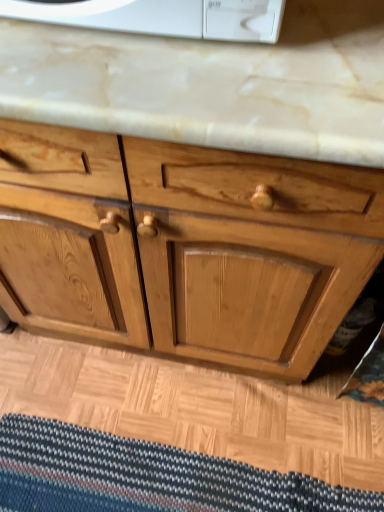
What do you see at coordinates (146, 476) in the screenshot? The width and height of the screenshot is (384, 512). I see `striped fabric doormat at lower center` at bounding box center [146, 476].

Find the location of `striped fabric doormat at lower center`. striped fabric doormat at lower center is located at coordinates (146, 476).

At what (x,y) coordinates should I click in order to perform the action: click on light brown wood chest of drawers at center. Please return your answer as a coordinate pair (x, y). This screenshot has width=384, height=512. Looking at the image, I should click on (188, 246).

From the picture: In order to face light brown wood chest of drawers at center, should I rotate leftwards or rightwards?

A 4.632 degree turn to the right will do.

Describe the element at coordinates (188, 246) in the screenshot. I see `light brown wood chest of drawers at center` at that location.

The image size is (384, 512). I want to click on striped fabric doormat at lower center, so click(146, 476).

Considering the relative positions of striped fabric doormat at lower center and light brown wood chest of drawers at center in the image provided, is striped fabric doormat at lower center to the right of light brown wood chest of drawers at center from the viewer's perspective?

No.

Considering their positions, is striped fabric doormat at lower center located in front of or behind light brown wood chest of drawers at center?

striped fabric doormat at lower center is behind light brown wood chest of drawers at center.

Which point is more distant from viewer, (29, 498) or (292, 303)?

The point (29, 498) is behind.

From the image's perspective, which is below, striped fabric doormat at lower center or light brown wood chest of drawers at center?

striped fabric doormat at lower center is shown below in the image.

From a real-world perspective, between striped fabric doormat at lower center and light brown wood chest of drawers at center, who is vertically higher?

light brown wood chest of drawers at center is physically above.

Does striped fabric doormat at lower center have a lesser width compared to light brown wood chest of drawers at center?

Yes, striped fabric doormat at lower center is thinner than light brown wood chest of drawers at center.

Looking at this image, considering the relative sizes of striped fabric doormat at lower center and light brown wood chest of drawers at center in the image provided, is striped fabric doormat at lower center shorter than light brown wood chest of drawers at center?

Correct, striped fabric doormat at lower center is not as tall as light brown wood chest of drawers at center.

Is striped fabric doormat at lower center bigger than light brown wood chest of drawers at center?

No.

Would you say striped fabric doormat at lower center is outside light brown wood chest of drawers at center?

Indeed, striped fabric doormat at lower center is completely outside light brown wood chest of drawers at center.

Is striped fabric doormat at lower center positioned far away from light brown wood chest of drawers at center?

No, striped fabric doormat at lower center is not far away from light brown wood chest of drawers at center.

Is striped fabric doormat at lower center looking in the opposite direction of light brown wood chest of drawers at center?

Absolutely, striped fabric doormat at lower center is directed away from light brown wood chest of drawers at center.

At what (x,y) coordinates should I click in order to perform the action: click on doormat behind the light brown wood chest of drawers at center. Please return your answer as a coordinate pair (x, y). Looking at the image, I should click on (146, 476).

Which object is positioned more to the left, light brown wood chest of drawers at center or striped fabric doormat at lower center?

striped fabric doormat at lower center is more to the left.

Which object is further away from the camera taking this photo, light brown wood chest of drawers at center or striped fabric doormat at lower center?

striped fabric doormat at lower center.

Is point (377, 223) closer to camera compared to point (264, 487)?

That is True.

From the image's perspective, which one is positioned lower, light brown wood chest of drawers at center or striped fabric doormat at lower center?

From the image's view, striped fabric doormat at lower center is below.

From a real-world perspective, relative to striped fabric doormat at lower center, is light brown wood chest of drawers at center vertically above or below?

In terms of real-world spatial position, light brown wood chest of drawers at center is above striped fabric doormat at lower center.

Which object is thinner, light brown wood chest of drawers at center or striped fabric doormat at lower center?

striped fabric doormat at lower center.

Between light brown wood chest of drawers at center and striped fabric doormat at lower center, which one has more height?

With more height is light brown wood chest of drawers at center.

Who is bigger, light brown wood chest of drawers at center or striped fabric doormat at lower center?

Bigger between the two is light brown wood chest of drawers at center.

Is light brown wood chest of drawers at center surrounding striped fabric doormat at lower center?

No, striped fabric doormat at lower center is not a part of light brown wood chest of drawers at center.

Is light brown wood chest of drawers at center touching striped fabric doormat at lower center?

light brown wood chest of drawers at center and striped fabric doormat at lower center are clearly separated.

Could you tell me if light brown wood chest of drawers at center is turned towards striped fabric doormat at lower center?

Yes.

How many degrees apart are the facing directions of light brown wood chest of drawers at center and striped fabric doormat at lower center?

The angle between the facing direction of light brown wood chest of drawers at center and the facing direction of striped fabric doormat at lower center is 0.562 degrees.

Measure the distance from light brown wood chest of drawers at center to striped fabric doormat at lower center.

light brown wood chest of drawers at center and striped fabric doormat at lower center are 19.05 inches apart from each other.

Find the location of a particular element. Image resolution: width=384 pixels, height=512 pixels. doormat lying on the left of light brown wood chest of drawers at center is located at coordinates tap(146, 476).

This screenshot has width=384, height=512. I want to click on the chest of drawers lying above the striped fabric doormat at lower center (from the image's perspective), so click(188, 246).

I want to click on chest of drawers in front of the striped fabric doormat at lower center, so click(188, 246).